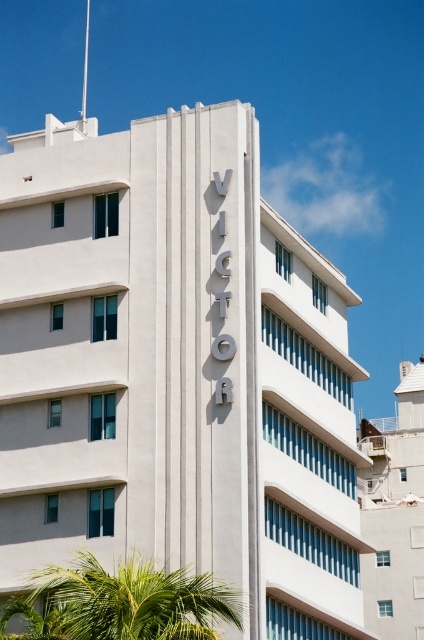
Question: Which object appears closest to the camera in this image?

Choices:
 (A) white smooth building at upper center
 (B) green leafy palm tree at lower left

Answer: (B)

Question: Observing the image, what is the correct spatial positioning of green leafy palm tree at lower left in reference to white smooth building at upper center?

Choices:
 (A) below
 (B) above

Answer: (B)

Question: Among these objects, which one is nearest to the camera?

Choices:
 (A) white smooth building at upper center
 (B) green leafy palm tree at lower left

Answer: (B)

Question: Is green leafy palm tree at lower left smaller than white smooth building at upper center?

Choices:
 (A) yes
 (B) no

Answer: (A)

Question: Does green leafy palm tree at lower left appear on the left side of white smooth building at upper center?

Choices:
 (A) no
 (B) yes

Answer: (B)